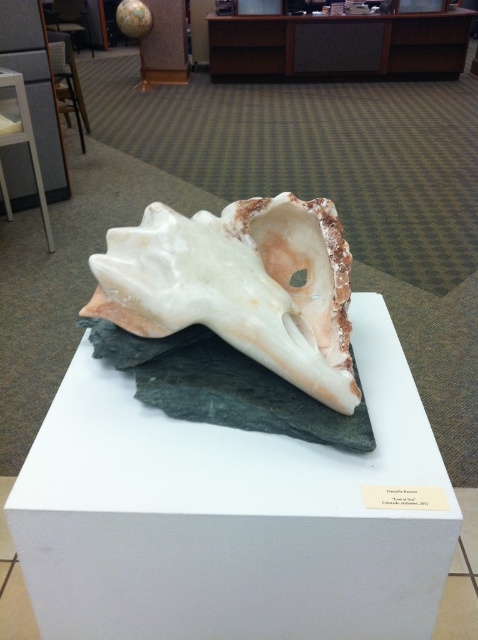
Question: Which point is farther to the camera?

Choices:
 (A) (423, 419)
 (B) (281, 280)

Answer: (B)

Question: Does white matte stone at center appear on the left side of white matte shell at center?

Choices:
 (A) yes
 (B) no

Answer: (A)

Question: Is white matte stone at center positioned behind white matte shell at center?

Choices:
 (A) yes
 (B) no

Answer: (B)

Question: Does white matte stone at center appear over white matte shell at center?

Choices:
 (A) no
 (B) yes

Answer: (A)